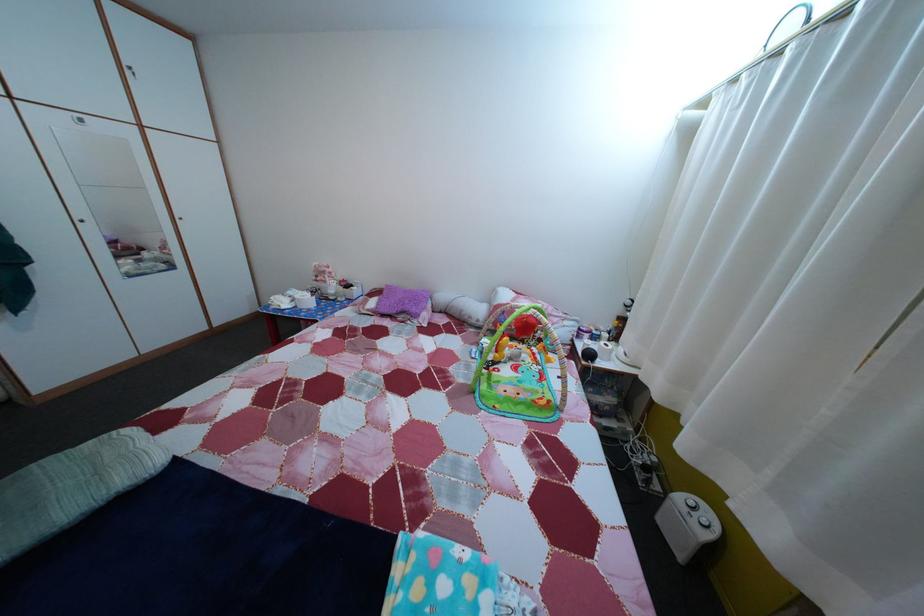
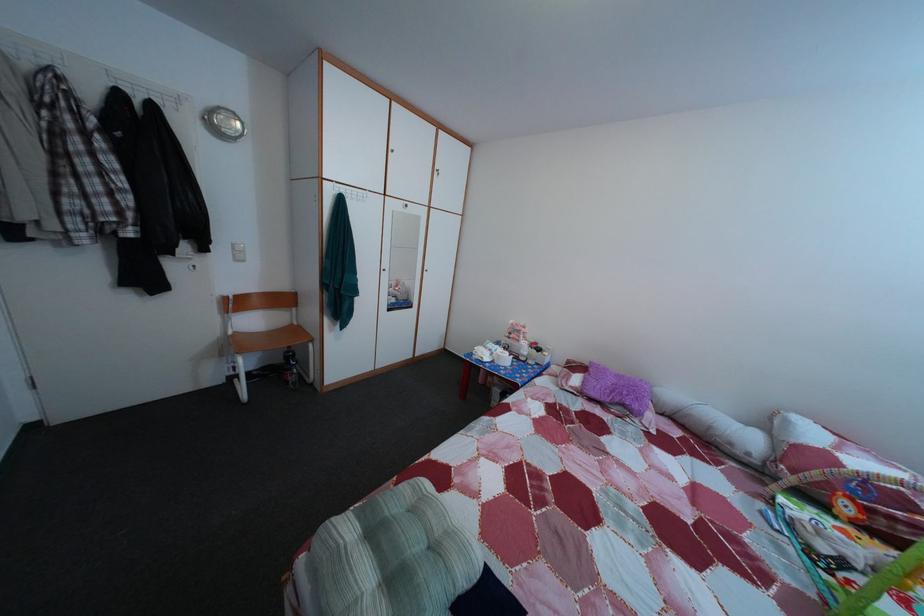
Question: Based on the continuous images, in which direction is the camera rotating? Reply with the corresponding letter.

Choices:
 (A) Left
 (B) Right
 (C) Up
 (D) Down

Answer: (A)